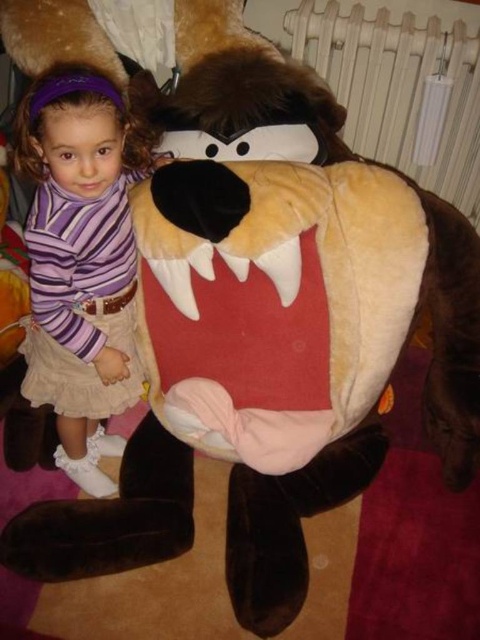
You are a photographer setting up a shoot in the scene described. You need to ensure that the purple striped shirt at left and the white plastic radiator at upper center are both visible in the frame. Given their heights, which object should you position closer to the camera to maintain both in focus?

The purple striped shirt at left is taller than the white plastic radiator at upper center. To keep both in focus, position the purple striped shirt at left closer to the camera since it is taller, ensuring both fit within the frame.

You are a photographer positioned in front of the scene. You want to capture a photo of the purple striped shirt at left without including the radiator in the background. Given that the shirt is 1.00 meters away from you, can you step back to achieve this?

The purple striped shirt at left is 1.00 meters away from the viewer. By stepping back, you can adjust your position to frame the shot so the radiator is no longer in the background while still capturing the shirt.

You are an interior designer assessing the space in the image. The purple striped shirt at left and the white plastic radiator at upper center are both in view. Which object occupies more visual space in the image?

The purple striped shirt at left has a larger size compared to the white plastic radiator at upper center, so it occupies more visual space in the image.